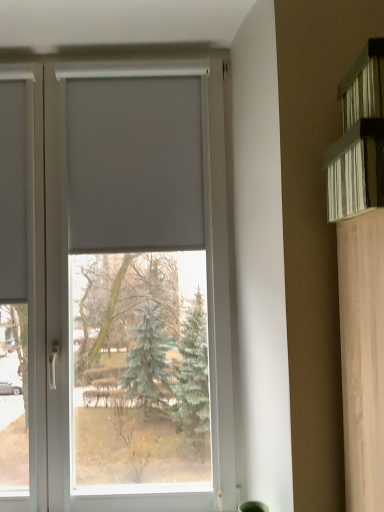
Question: Is white matte window at center looking in the opposite direction of white matte blind at center?

Choices:
 (A) no
 (B) yes

Answer: (B)

Question: Considering the relative sizes of white matte window at center and white matte blind at center in the image provided, is white matte window at center smaller than white matte blind at center?

Choices:
 (A) yes
 (B) no

Answer: (B)

Question: Can you confirm if white matte window at center is positioned to the right of white matte blind at center?

Choices:
 (A) yes
 (B) no

Answer: (B)

Question: From a real-world perspective, does white matte window at center stand above white matte blind at center?

Choices:
 (A) yes
 (B) no

Answer: (B)

Question: Can you confirm if white matte window at center is wider than white matte blind at center?

Choices:
 (A) yes
 (B) no

Answer: (A)

Question: Considering the positions of white textured shelf at upper right and white matte window at center in the image, is white textured shelf at upper right bigger or smaller than white matte window at center?

Choices:
 (A) big
 (B) small

Answer: (B)

Question: Considering the positions of white textured shelf at upper right and white matte window at center in the image, is white textured shelf at upper right taller or shorter than white matte window at center?

Choices:
 (A) tall
 (B) short

Answer: (B)

Question: Would you say white textured shelf at upper right is inside or outside white matte window at center?

Choices:
 (A) inside
 (B) outside

Answer: (B)

Question: From the image's perspective, is white textured shelf at upper right above or below white matte window at center?

Choices:
 (A) above
 (B) below

Answer: (A)

Question: Relative to white matte blind at center, is white matte window at center in front or behind?

Choices:
 (A) front
 (B) behind

Answer: (A)

Question: Is point (46, 117) closer or farther from the camera than point (190, 109)?

Choices:
 (A) farther
 (B) closer

Answer: (A)

Question: Would you say white matte window at center is to the left or to the right of white matte blind at center in the picture?

Choices:
 (A) left
 (B) right

Answer: (A)

Question: Is white matte window at center spatially inside white matte blind at center, or outside of it?

Choices:
 (A) inside
 (B) outside

Answer: (B)

Question: Is point (182, 229) closer or farther from the camera than point (226, 233)?

Choices:
 (A) farther
 (B) closer

Answer: (B)

Question: Is white matte blind at center inside or outside of white matte window at center?

Choices:
 (A) outside
 (B) inside

Answer: (B)